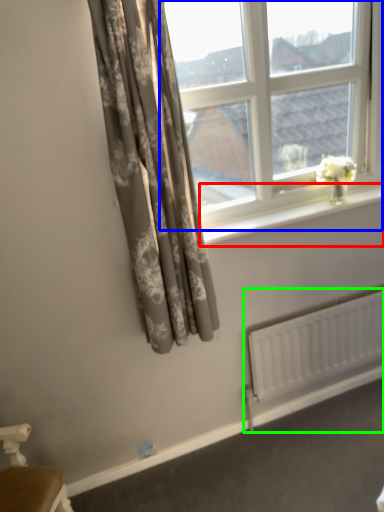
Question: Which is nearer to the window sill (highlighted by a red box)? window (highlighted by a blue box) or radiator (highlighted by a green box).

Choices:
 (A) window
 (B) radiator

Answer: (A)